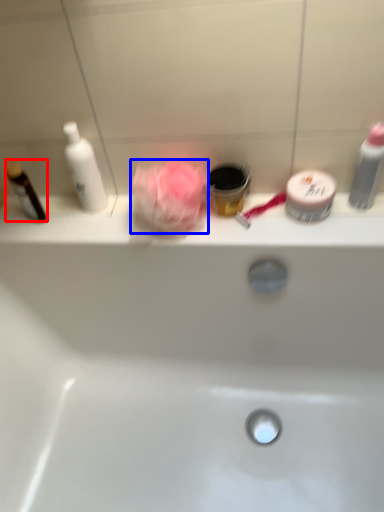
Question: Which object appears farthest to the camera in this image, toiletry (highlighted by a red box) or rose (highlighted by a blue box)?

Choices:
 (A) toiletry
 (B) rose

Answer: (A)